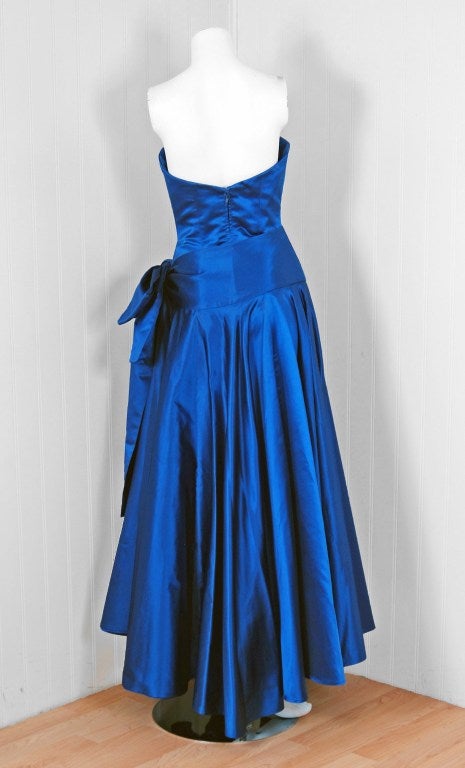
Find the location of a particular element. stand is located at coordinates (183, 720).